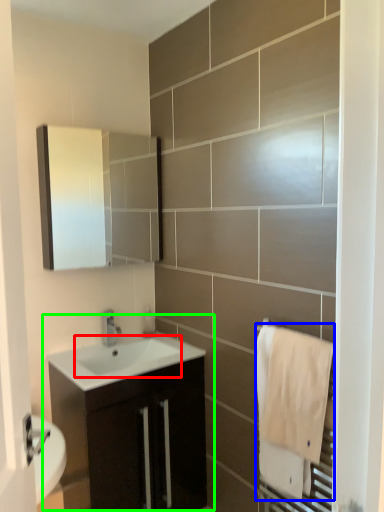
Question: Which object is positioned farthest from sink (highlighted by a red box)? Select from bath towel (highlighted by a blue box) and bathroom cabinet (highlighted by a green box).

Choices:
 (A) bath towel
 (B) bathroom cabinet

Answer: (A)